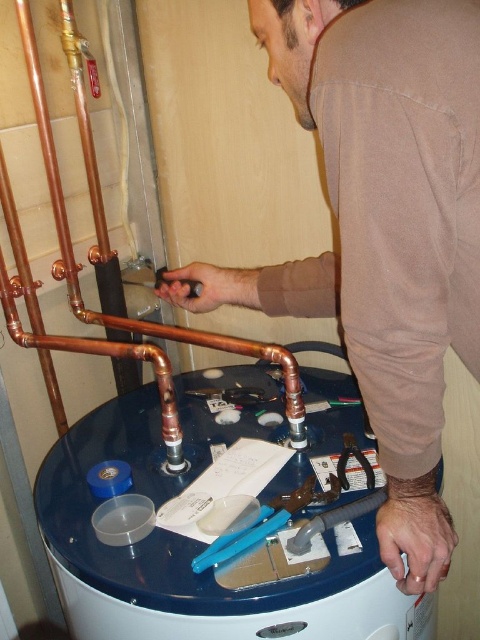
Is blue glossy water tank at center further to the viewer compared to copper pipe at left?

That is False.

Can you confirm if blue glossy water tank at center is positioned to the left of copper pipe at left?

Incorrect, blue glossy water tank at center is not on the left side of copper pipe at left.

What do you see at coordinates (201, 545) in the screenshot? I see `blue glossy water tank at center` at bounding box center [201, 545].

Where is `blue glossy water tank at center`? blue glossy water tank at center is located at coordinates (201, 545).

Which is more to the right, brown cotton shirt at center or copper pipe at left?

brown cotton shirt at center is more to the right.

Consider the image. Is brown cotton shirt at center above copper pipe at left?

No, brown cotton shirt at center is not above copper pipe at left.

Where is `brown cotton shirt at center`? The width and height of the screenshot is (480, 640). brown cotton shirt at center is located at coordinates [x=383, y=228].

Is brown cotton shirt at center to the right of blue glossy water tank at center from the viewer's perspective?

Indeed, brown cotton shirt at center is positioned on the right side of blue glossy water tank at center.

Find the location of a particular element. The image size is (480, 640). brown cotton shirt at center is located at coordinates (383, 228).